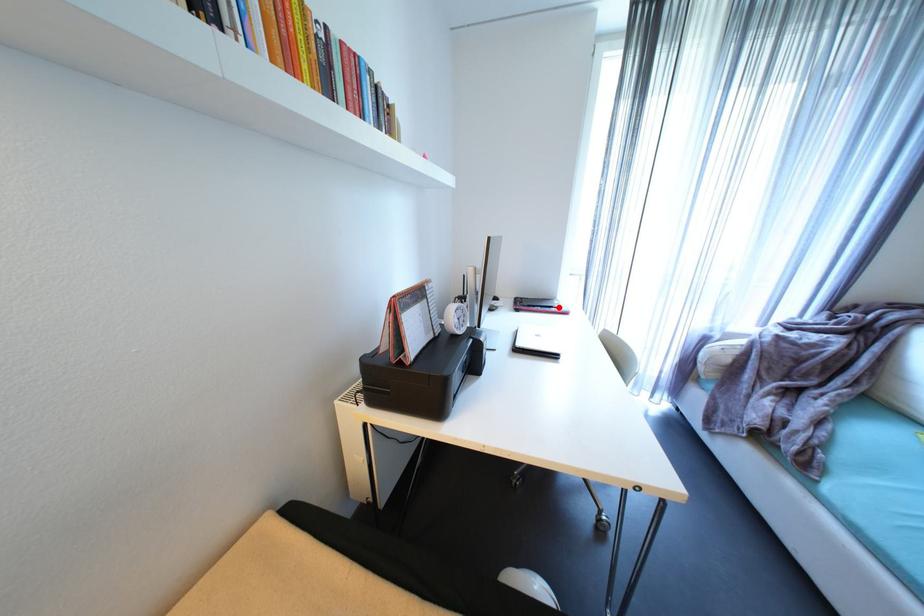
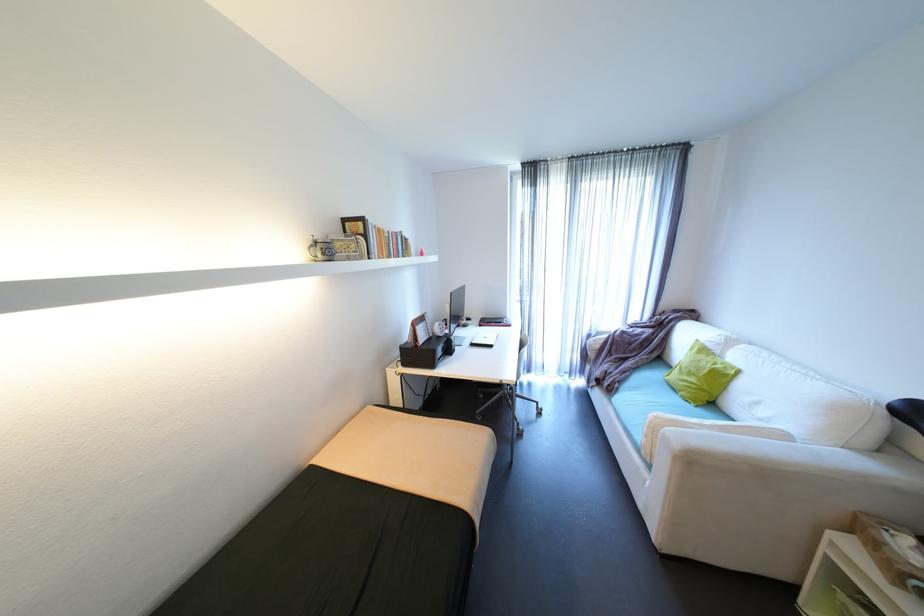
Locate, in the second image, the point that corresponds to the highlighted location in the first image.

(508, 323)